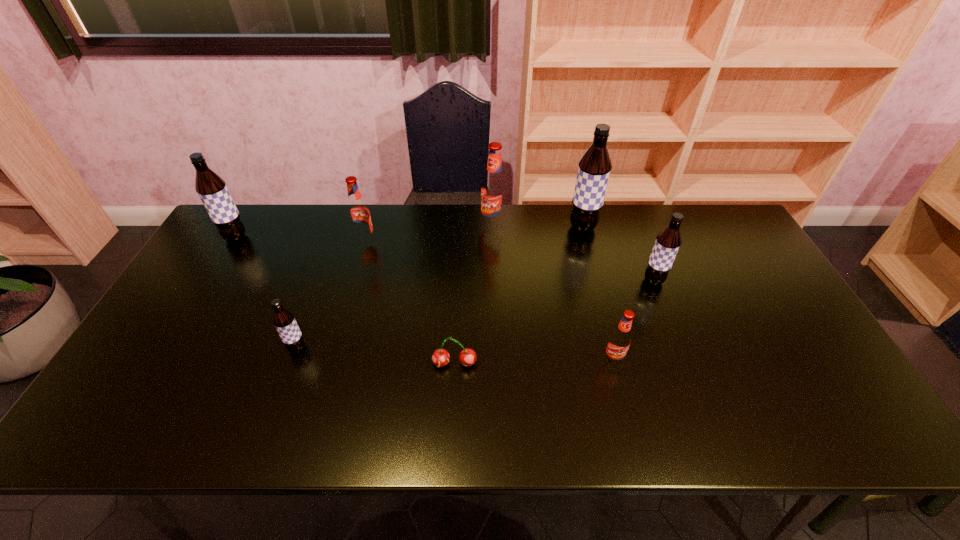
Where is `empty location between the leftmost root beer and the second brown root beer from left to right`? empty location between the leftmost root beer and the second brown root beer from left to right is located at coordinates (267, 293).

The width and height of the screenshot is (960, 540). In order to click on object that is the seventh nearest to the rightmost object in this screenshot , I will do `click(211, 188)`.

Select which object appears as the seventh closest to the second red root beer from right to left. Please provide its 2D coordinates. Your answer should be formatted as a tuple, i.e. [(x, y)], where the tuple contains the x and y coordinates of a point satisfying the conditions above.

[(211, 188)]

Identify which root beer is the fifth nearest to the tallest root beer. Please provide its 2D coordinates. Your answer should be formatted as a tuple, i.e. [(x, y)], where the tuple contains the x and y coordinates of a point satisfying the conditions above.

[(284, 321)]

Locate an element on the screen. The width and height of the screenshot is (960, 540). root beer that stands as the third closest to the second smallest red root beer is located at coordinates (284, 321).

In order to click on the closest brown root beer to the fourth object from right to left in this screenshot , I will do `click(594, 169)`.

Where is `brown root beer that is the nearest to the rightmost root beer`? The image size is (960, 540). brown root beer that is the nearest to the rightmost root beer is located at coordinates (594, 169).

Image resolution: width=960 pixels, height=540 pixels. Find the location of `red root beer object that ranks as the closest to the second red root beer from right to left`. red root beer object that ranks as the closest to the second red root beer from right to left is located at coordinates point(358,212).

Image resolution: width=960 pixels, height=540 pixels. What are the coordinates of `red root beer that is the third closest to the third brown root beer from right to left` in the screenshot? It's located at (619, 341).

Where is `vacant space that satisfies the following two spatial constraints: 1. on the back side of the fourth object from right to left; 2. on the left side of the sixth object from right to left`? The image size is (960, 540). vacant space that satisfies the following two spatial constraints: 1. on the back side of the fourth object from right to left; 2. on the left side of the sixth object from right to left is located at coordinates (370, 225).